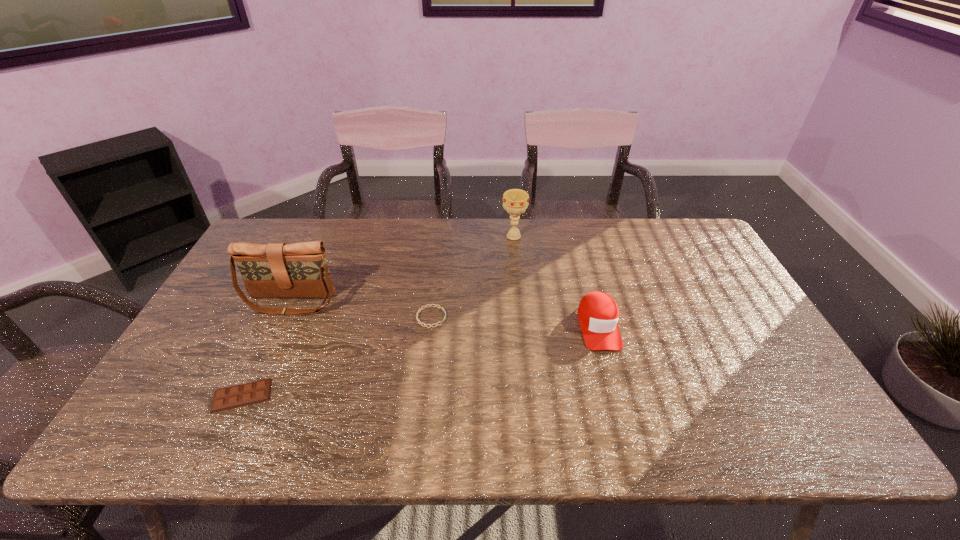
Find the location of a particular element. vacant area at the right edge is located at coordinates (696, 297).

This screenshot has height=540, width=960. In the image, there is a desktop. Identify the location of free region at the far right corner. (688, 220).

At what (x,y) coordinates should I click in order to perform the action: click on vacant space at the near right corner of the desktop. Please return your answer as a coordinate pair (x, y). Looking at the image, I should click on (755, 416).

Where is `free spot between the bracelet and the shoulder bag`? free spot between the bracelet and the shoulder bag is located at coordinates (361, 309).

At what (x,y) coordinates should I click in order to perform the action: click on vacant space that's between the nearest object and the bracelet. Please return your answer as a coordinate pair (x, y). Looking at the image, I should click on (337, 356).

At what (x,y) coordinates should I click in order to perform the action: click on free space between the chalice and the third object from right to left. Please return your answer as a coordinate pair (x, y). The height and width of the screenshot is (540, 960). Looking at the image, I should click on (472, 276).

The width and height of the screenshot is (960, 540). Identify the location of free space between the bracelet and the second tallest object. (472, 276).

Locate an element on the screen. vacant point located between the shoulder bag and the chocolate bar is located at coordinates (267, 348).

Where is `vacant area that lies between the third shortest object and the shoulder bag`? The height and width of the screenshot is (540, 960). vacant area that lies between the third shortest object and the shoulder bag is located at coordinates (444, 314).

Where is `vacant space in between the third object from left to right and the rightmost object`? vacant space in between the third object from left to right and the rightmost object is located at coordinates (515, 321).